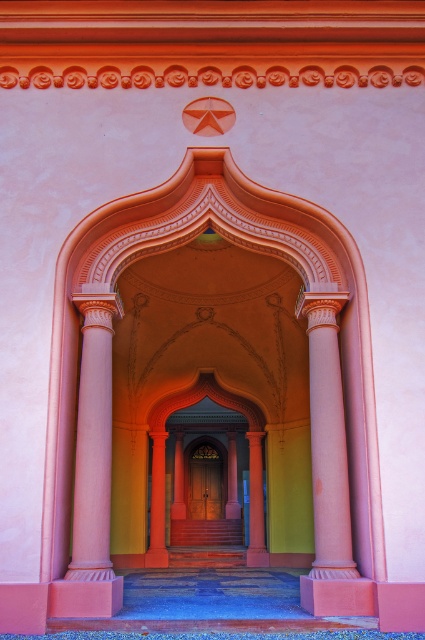
Question: Does pink polished column at left have a smaller size compared to pink glossy column at center?

Choices:
 (A) yes
 (B) no

Answer: (B)

Question: Does brown wooden door at center appear over pink glossy column at center?

Choices:
 (A) yes
 (B) no

Answer: (B)

Question: Which object is positioned closest to the brown wooden door at center?

Choices:
 (A) polished wood door at center
 (B) pink polished column at left
 (C) pink polished stone column at center

Answer: (A)

Question: Does pink polished column at left appear on the right side of pink glossy column at center?

Choices:
 (A) yes
 (B) no

Answer: (B)

Question: Which point appears closest to the camera in this image?

Choices:
 (A) (326, 362)
 (B) (153, 564)
 (C) (260, 442)
 (D) (217, 474)

Answer: (A)

Question: Which of the following is the farthest from the observer?

Choices:
 (A) pink glossy column at center
 (B) polished wood door at center
 (C) brown wooden door at center

Answer: (C)